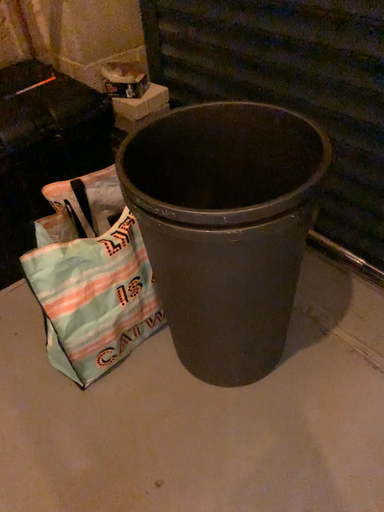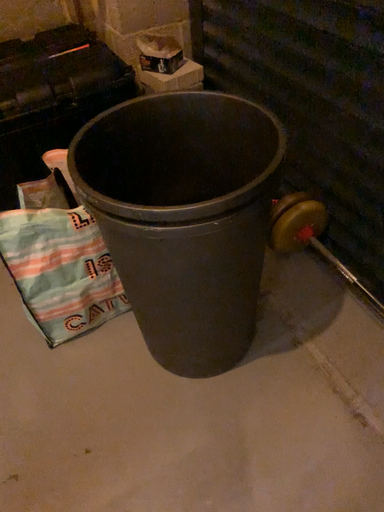
Question: How did the camera likely rotate when shooting the video?

Choices:
 (A) rotated left
 (B) rotated right

Answer: (A)